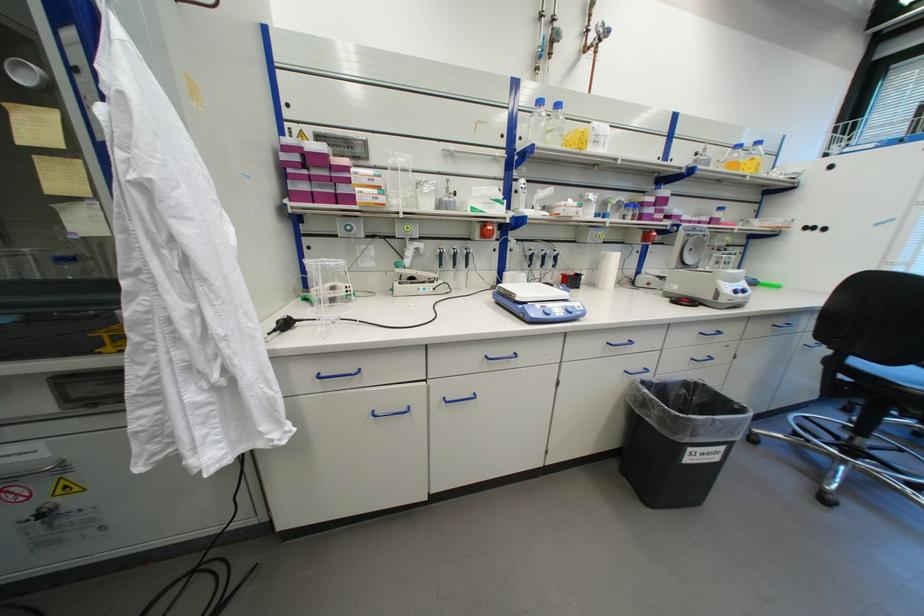
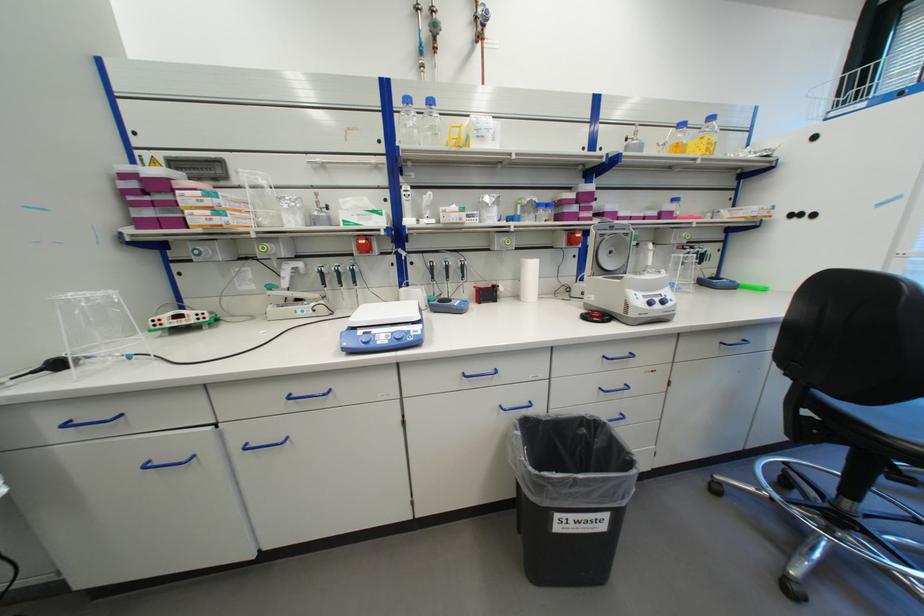
The point at (697, 262) is marked in the first image. Where is the corresponding point in the second image?

(616, 267)